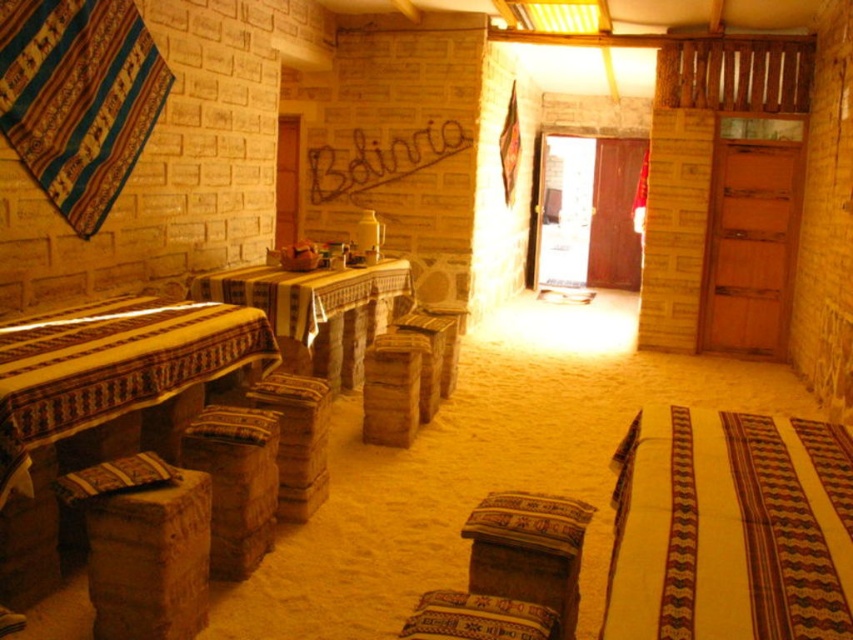
Question: Is striped cotton blanket at lower right wider than rustic wood stool at lower left?

Choices:
 (A) no
 (B) yes

Answer: (B)

Question: Which object is the farthest from the rustic wood stool at lower left?

Choices:
 (A) rustic woven stool at center
 (B) rustic woven stool at lower left
 (C) patterned fabric pillow at lower left
 (D) striped cotton blanket at lower right

Answer: (D)

Question: Does rustic woven stool at lower left appear on the right side of wooden stool at center?

Choices:
 (A) no
 (B) yes

Answer: (A)

Question: Is textured woven stool at lower center wider than patterned fabric pillow at lower left?

Choices:
 (A) no
 (B) yes

Answer: (B)

Question: Which of these objects is positioned farthest from the wooden stool at center?

Choices:
 (A) striped cotton blanket at lower right
 (B) rustic woven stool at center

Answer: (A)

Question: Considering the real-world distances, which object is closest to the striped cotton blanket at lower right?

Choices:
 (A) rustic woven stool at center
 (B) rustic woven stool at lower left

Answer: (B)